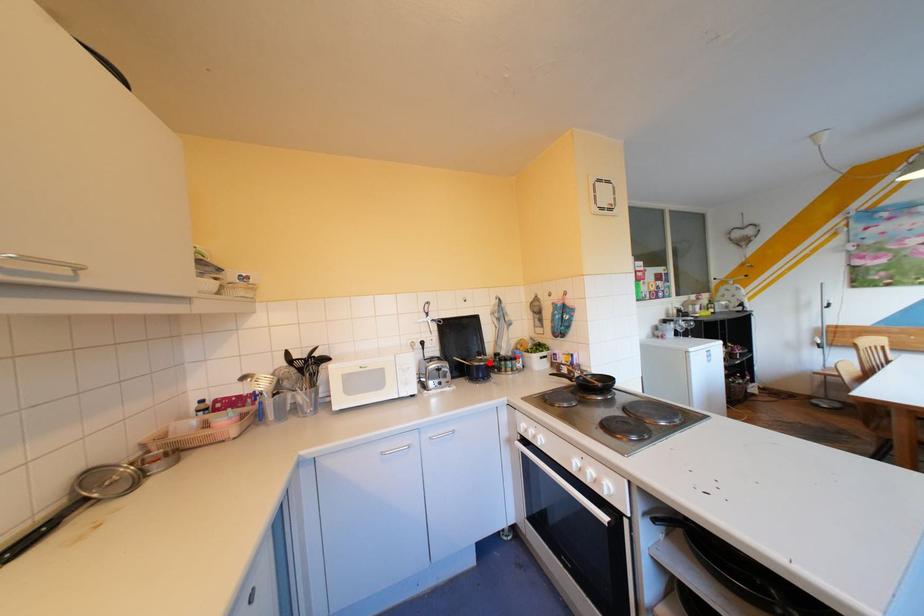
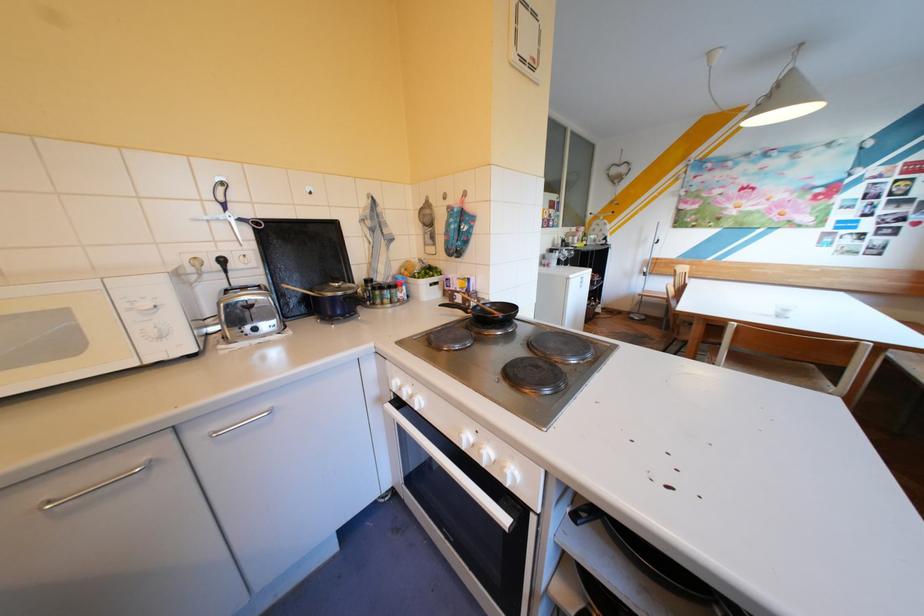
Question: I am providing you with two images of the same scene from different viewpoints. Given a red point in image1, look at the same physical point in image2. Is it:

Choices:
 (A) Closer to the viewpoint
 (B) Farther from the viewpoint

Answer: (A)